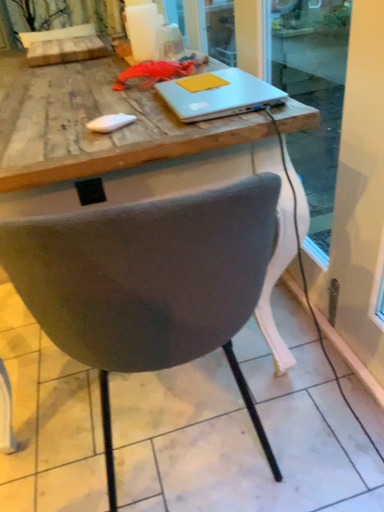
Question: Is sleek white laptop at center to the right of white textured curtain at upper left from the viewer's perspective?

Choices:
 (A) yes
 (B) no

Answer: (A)

Question: From the image's perspective, would you say sleek white laptop at center is positioned over white textured curtain at upper left?

Choices:
 (A) yes
 (B) no

Answer: (B)

Question: Does sleek white laptop at center have a smaller size compared to white textured curtain at upper left?

Choices:
 (A) no
 (B) yes

Answer: (B)

Question: Does sleek white laptop at center have a larger size compared to white textured curtain at upper left?

Choices:
 (A) no
 (B) yes

Answer: (A)

Question: From a real-world perspective, is sleek white laptop at center on white textured curtain at upper left?

Choices:
 (A) no
 (B) yes

Answer: (A)

Question: Is sleek white laptop at center outside white textured curtain at upper left?

Choices:
 (A) no
 (B) yes

Answer: (B)

Question: Does yellow matte notepad at upper center come in front of white textured curtain at upper left?

Choices:
 (A) yes
 (B) no

Answer: (A)

Question: From a real-world perspective, is yellow matte notepad at upper center on white textured curtain at upper left?

Choices:
 (A) yes
 (B) no

Answer: (B)

Question: From the image's perspective, would you say yellow matte notepad at upper center is positioned over white textured curtain at upper left?

Choices:
 (A) no
 (B) yes

Answer: (A)

Question: Is yellow matte notepad at upper center oriented towards white textured curtain at upper left?

Choices:
 (A) no
 (B) yes

Answer: (A)

Question: Is yellow matte notepad at upper center outside of white textured curtain at upper left?

Choices:
 (A) yes
 (B) no

Answer: (A)

Question: Is yellow matte notepad at upper center next to white textured curtain at upper left and touching it?

Choices:
 (A) no
 (B) yes

Answer: (A)

Question: Considering the relative sizes of yellow matte notepad at upper center and sleek white laptop at center in the image provided, is yellow matte notepad at upper center wider than sleek white laptop at center?

Choices:
 (A) yes
 (B) no

Answer: (B)